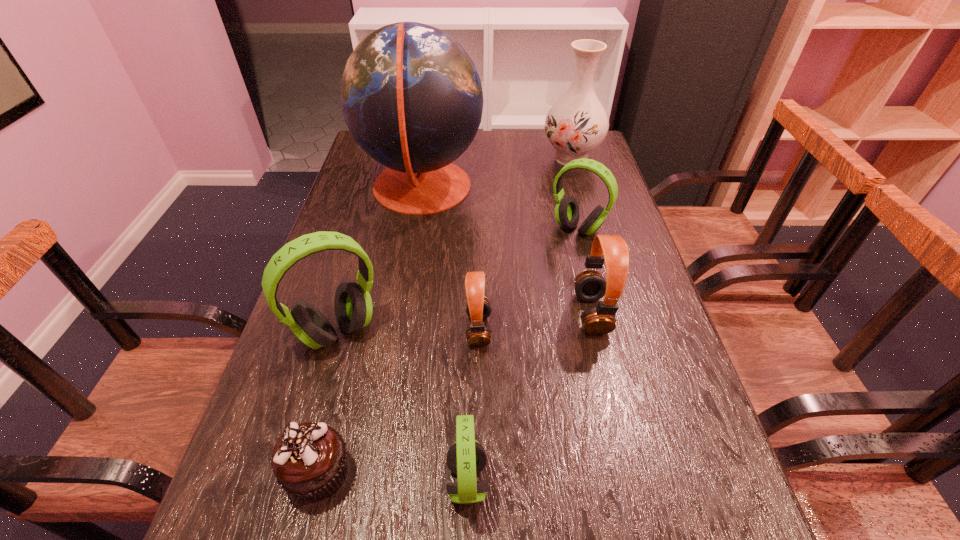
Locate an element on the screen. The width and height of the screenshot is (960, 540). vacant space that is in between the cupcake and the farthest green headset is located at coordinates (448, 350).

At what (x,y) coordinates should I click in order to perform the action: click on empty space that is in between the smallest green headset and the rightmost green headset. Please return your answer as a coordinate pair (x, y). The height and width of the screenshot is (540, 960). Looking at the image, I should click on (522, 354).

I want to click on unoccupied position between the right brown headset and the second tallest object, so click(x=582, y=236).

Identify the location of vacant space in between the left brown headset and the smallest green headset. This screenshot has height=540, width=960. (473, 405).

The height and width of the screenshot is (540, 960). Identify the location of object that is the third closest to the second green headset from left to right. (353, 307).

Select which object appears as the seventh closest to the smallest green headset. Please provide its 2D coordinates. Your answer should be formatted as a tuple, i.e. [(x, y)], where the tuple contains the x and y coordinates of a point satisfying the conditions above.

[(577, 123)]

Point out which headset is positioned as the fourth nearest to the globe. Please provide its 2D coordinates. Your answer should be formatted as a tuple, i.e. [(x, y)], where the tuple contains the x and y coordinates of a point satisfying the conditions above.

[(590, 285)]

Select which headset is the fourth closest to the farthest green headset. Please provide its 2D coordinates. Your answer should be formatted as a tuple, i.e. [(x, y)], where the tuple contains the x and y coordinates of a point satisfying the conditions above.

[(466, 458)]

You are a GUI agent. You are given a task and a screenshot of the screen. Output one action in this format:
    pyautogui.click(x=<x>, y=<y>)
    Task: Click on the green headset that stands as the third closest to the brown cupcake
    
    Given the screenshot: What is the action you would take?
    pyautogui.click(x=567, y=212)

Where is `the closest green headset to the second green headset from left to right`? the closest green headset to the second green headset from left to right is located at coordinates (353, 307).